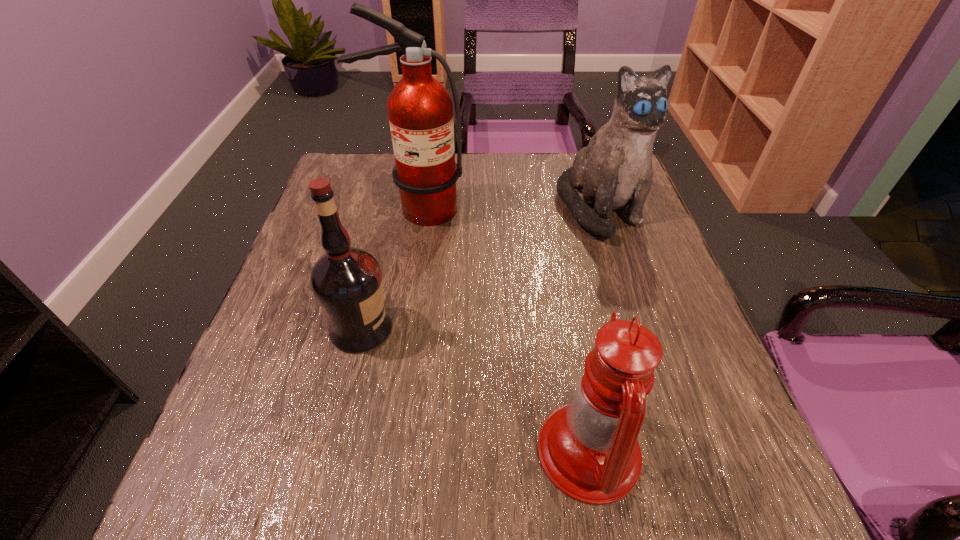
Find the location of `the tallest object`. the tallest object is located at coordinates (420, 109).

You are a GUI agent. You are given a task and a screenshot of the screen. Output one action in this format:
    pyautogui.click(x=<x>, y=<y>)
    Task: Click on the cat
    
    Given the screenshot: What is the action you would take?
    pyautogui.click(x=615, y=170)

Identify the location of the second nearest object. This screenshot has height=540, width=960. (347, 283).

In order to click on oil lamp in this screenshot , I will do `click(588, 449)`.

This screenshot has height=540, width=960. I want to click on free space located on the nozzle and handle of the tallest object, so click(x=397, y=326).

Locate an element on the screen. This screenshot has height=540, width=960. free space located at the face of the cat is located at coordinates (648, 360).

You are a GUI agent. You are given a task and a screenshot of the screen. Output one action in this format:
    pyautogui.click(x=<x>, y=<y>)
    Task: Click on the vacant position located on the surface of the third farthest object
    Image resolution: width=960 pixels, height=540 pixels.
    Given the screenshot: What is the action you would take?
    pyautogui.click(x=499, y=328)

I want to click on vacant space located 0.370m on the left of the nearest object, so click(291, 451).

Find the location of `fire extinguisher at the far edge`. fire extinguisher at the far edge is located at coordinates point(420,109).

Where is `cat that is at the far edge`? cat that is at the far edge is located at coordinates (615, 170).